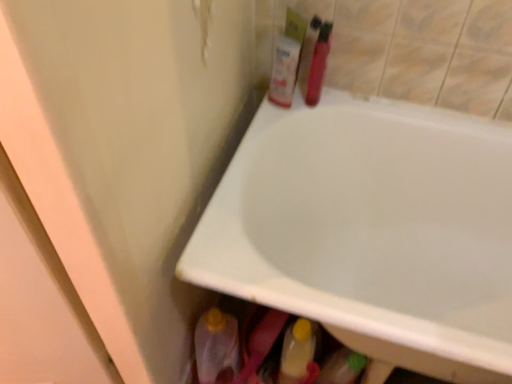
At what (x,y) coordinates should I click in order to perform the action: click on vacant area located to the right-hand side of shiny plastic bottle at upper right, placed as the second toiletry when sorted from left to right. Please return your answer as a coordinate pair (x, y). Looking at the image, I should click on pos(356,101).